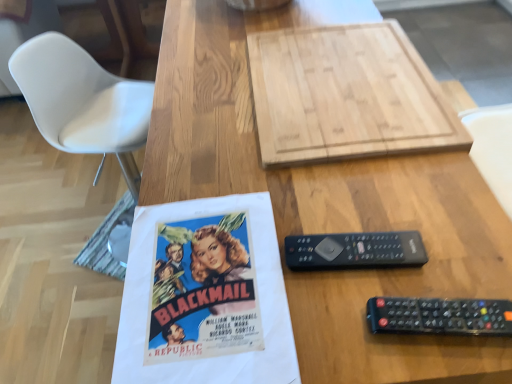
I want to click on free location to the left of black plastic remote at right, so click(x=223, y=274).